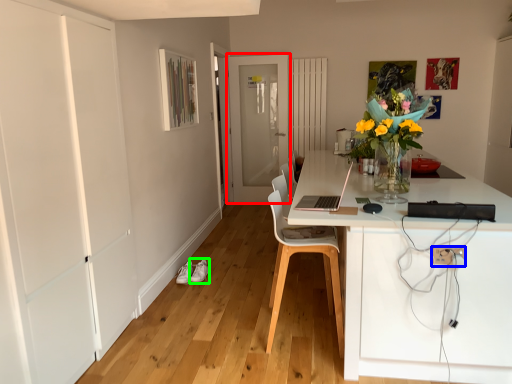
Question: Which object is positioned farthest from door (highlighted by a red box)? Select from electric outlet (highlighted by a blue box) and shoe (highlighted by a green box).

Choices:
 (A) electric outlet
 (B) shoe

Answer: (A)